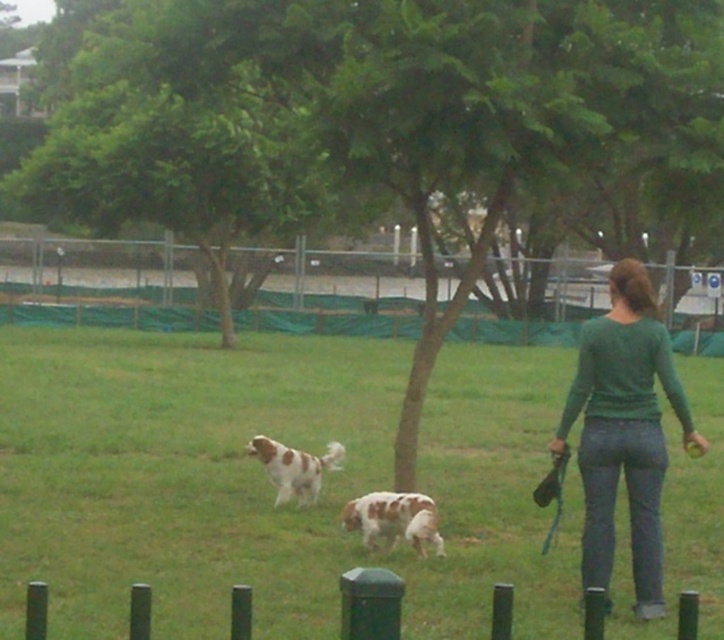
You are a photographer trying to capture both the spotted fur dog at center and the white speckled fur dog at center in a single frame. Since you want to ensure both are clearly visible, which dog should you focus on first to account for their size difference?

You should focus on the spotted fur dog at center first because it is smaller than the white speckled fur dog at center, so ensuring its details are clear before adjusting for the larger one.

You are a photographer trying to capture a clear shot of the white speckled fur dog at center. Since the green grass at center is in the foreground, will the grass block your view of the dog?

The green grass at center has a larger size compared to white speckled fur dog at center, so it might block the view of the dog if positioned in front.

You are standing at the point with coordinates point (366, 376) and want to walk towards the point with coordinates point (287, 460). Based on the scene description, will you be moving towards the dogs or away from them?

Based on the coordinates, point (366, 376) is behind point (287, 460). Since the dogs are in the foreground and the person is walking towards them, moving from the point (366, 376) towards point (287, 460) means you are moving towards the dogs.